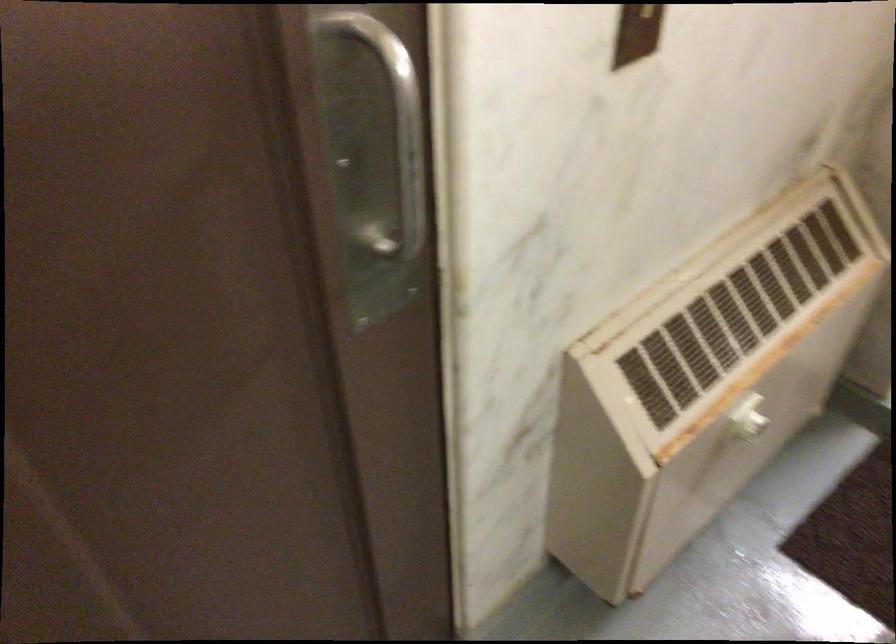
The image size is (896, 644). What do you see at coordinates (391, 120) in the screenshot?
I see `a metal door handle` at bounding box center [391, 120].